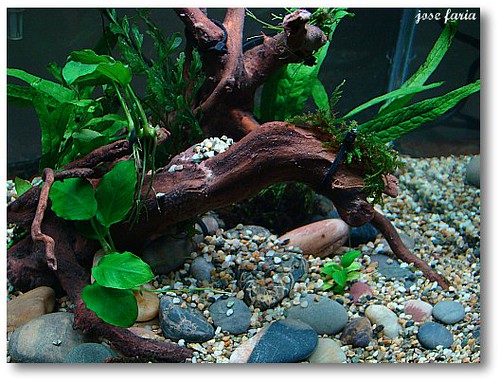
The image size is (500, 382). In order to click on dark wall in this screenshot , I will do coord(45,42), coord(358,67).